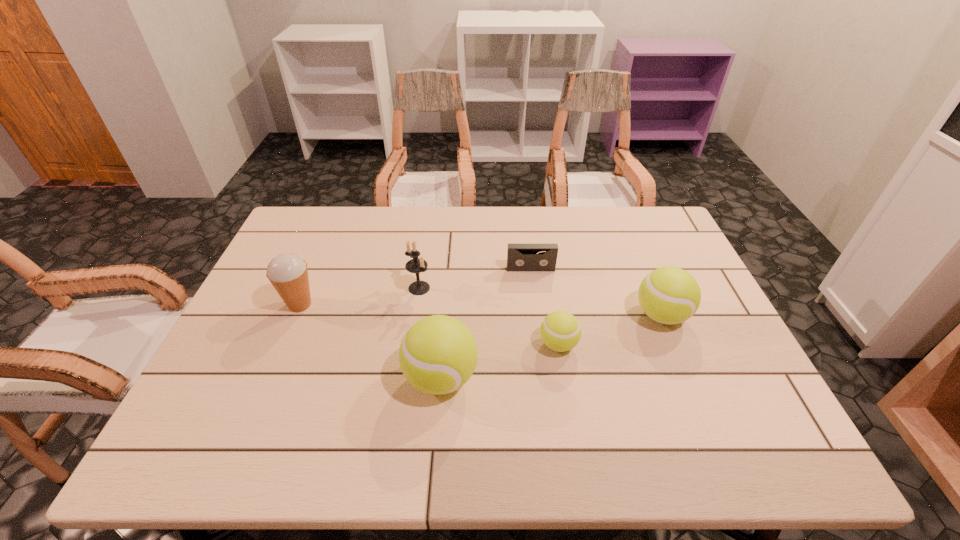
I want to click on vacant area that satisfies the following two spatial constraints: 1. on the back side of the shortest tennis ball; 2. on the left side of the leftmost tennis ball, so click(x=444, y=345).

Locate an element on the screen. The width and height of the screenshot is (960, 540). free space that satisfies the following two spatial constraints: 1. on the back side of the shortest tennis ball; 2. on the left side of the leftmost tennis ball is located at coordinates (444, 345).